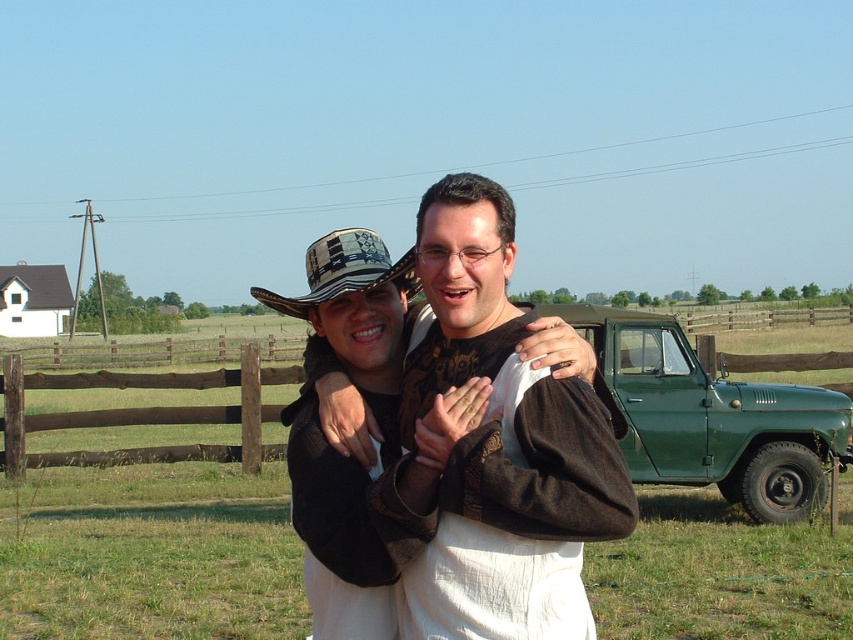
You are standing at the center of the image and want to locate the green matte pickup truck at right. What are the coordinates of the truck?

The green matte pickup truck at right is located at coordinates point (711, 417).

You are a photographer trying to capture a closeup of the white cotton shirt at center and the patterned fabric cowboy hat at center. Which object should you zoom in on more to ensure both are in focus?

The white cotton shirt at center has a smaller size compared to patterned fabric cowboy hat at center, so you should zoom in more on the white cotton shirt at center to ensure both are in focus.